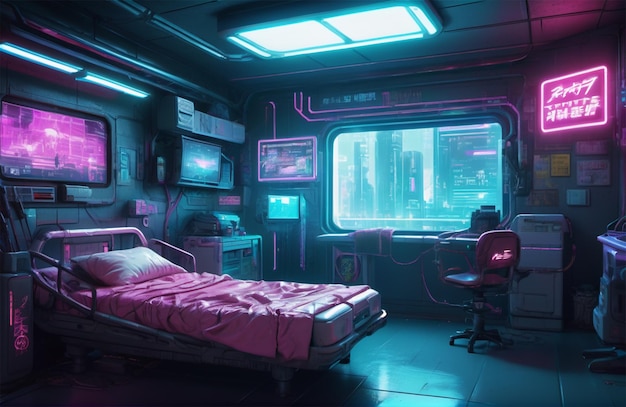
Image resolution: width=626 pixels, height=407 pixels. In order to click on purple bedding in this screenshot , I will do `click(265, 333)`.